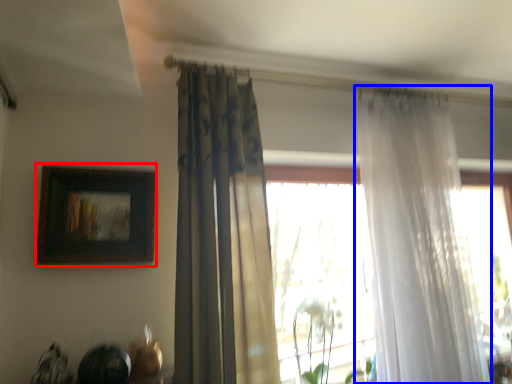
Question: Which object appears closest to the camera in this image, picture frame (highlighted by a red box) or curtain (highlighted by a blue box)?

Choices:
 (A) picture frame
 (B) curtain

Answer: (A)